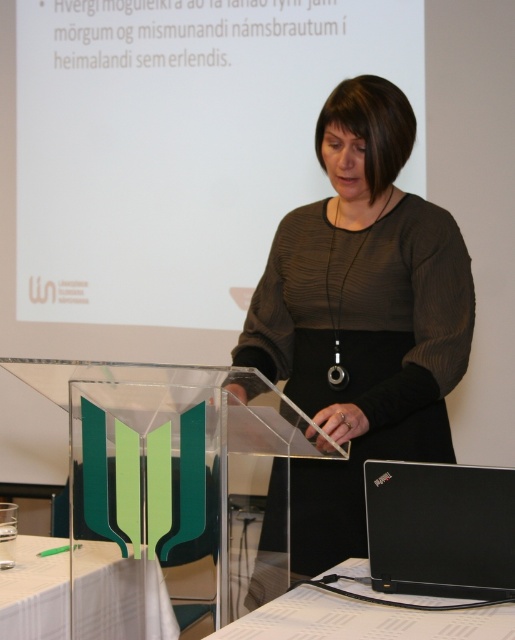
You are organizing a fashion show and need to decide which item takes up more space in the storage. Based on the image, which item is bigger between the matte black dress at center and the white glossy table at lower left?

The matte black dress at center is larger in size than the white glossy table at lower left, so the matte black dress at center takes up more space in the storage.

You are an attendee at the presentation. You need to take notes on your black matte laptop at lower right. Where should you position yourself relative to the podium to ensure the laptop is within your reach?

The black matte laptop at lower right is located at point (440, 529), which means it is positioned to the lower right of the image. To reach it, you should stand to the right side of the podium so that the laptop is within your immediate reach.

In the scene shown: You are organizing an event and need to decide whether the matte black dress at center can be placed on the black plastic table at lower center without hanging over the edges. Based on their sizes, what would you advise?

The matte black dress at center has a larger width than the black plastic table at lower center, so placing it on the table would cause the dress to hang over the edges. It would be better to choose a larger table or fold the dress to fit.